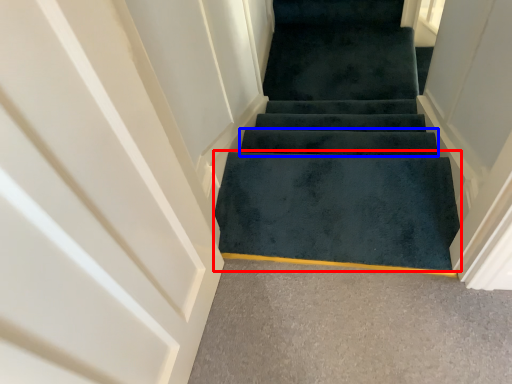
Question: Which of the following is the closest to the observer, doormat (highlighted by a red box) or stair (highlighted by a blue box)?

Choices:
 (A) doormat
 (B) stair

Answer: (A)